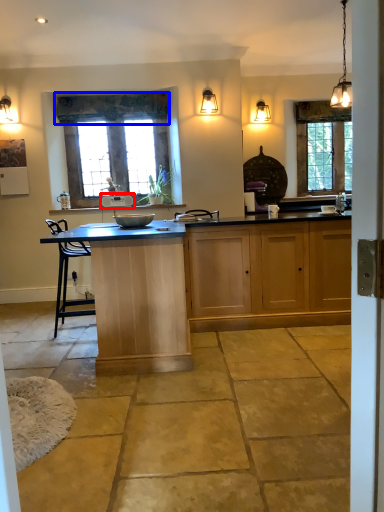
Question: Which object is closer to the camera taking this photo, appliance (highlighted by a red box) or curtain (highlighted by a blue box)?

Choices:
 (A) appliance
 (B) curtain

Answer: (B)